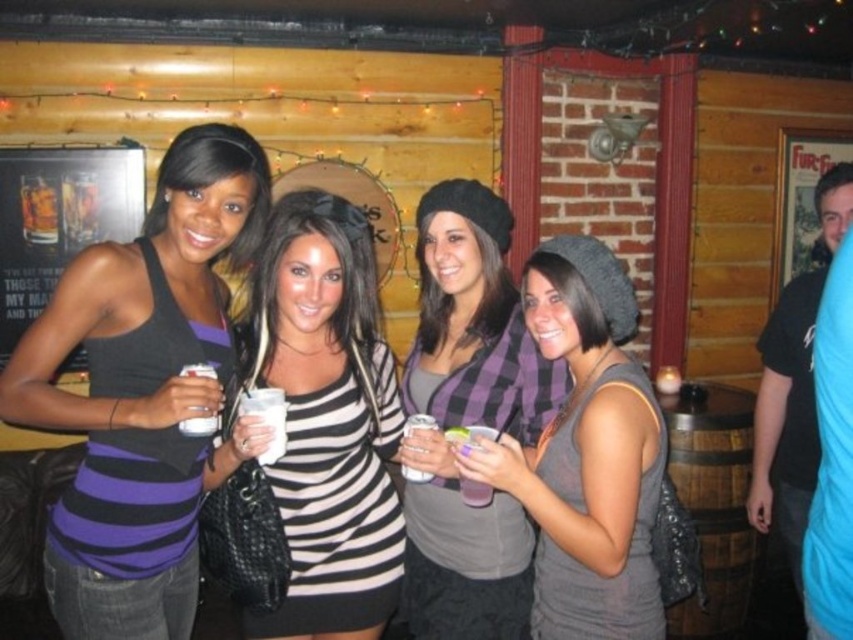
Between translucent plastic cup at center and clear plastic cup at center, which one is positioned lower?

clear plastic cup at center is below.

Find the location of `translucent plastic cup at center`. translucent plastic cup at center is located at coordinates (469, 435).

The width and height of the screenshot is (853, 640). I want to click on purple striped tank top at center, so click(x=141, y=390).

Is purple striped tank top at center below gray matte beanie at center?

Actually, purple striped tank top at center is above gray matte beanie at center.

What do you see at coordinates (141, 390) in the screenshot? Image resolution: width=853 pixels, height=640 pixels. I see `purple striped tank top at center` at bounding box center [141, 390].

Locate an element on the screen. The image size is (853, 640). purple striped tank top at center is located at coordinates (141, 390).

Between purple striped tank top at center and plaid fabric scarf at center, which one appears on the right side from the viewer's perspective?

plaid fabric scarf at center

Who is lower down, purple striped tank top at center or plaid fabric scarf at center?

Positioned lower is plaid fabric scarf at center.

Measure the distance between point (219, 241) and camera.

Point (219, 241) and camera are 1.66 meters apart from each other.

Find the location of `purple striped tank top at center`. purple striped tank top at center is located at coordinates (141, 390).